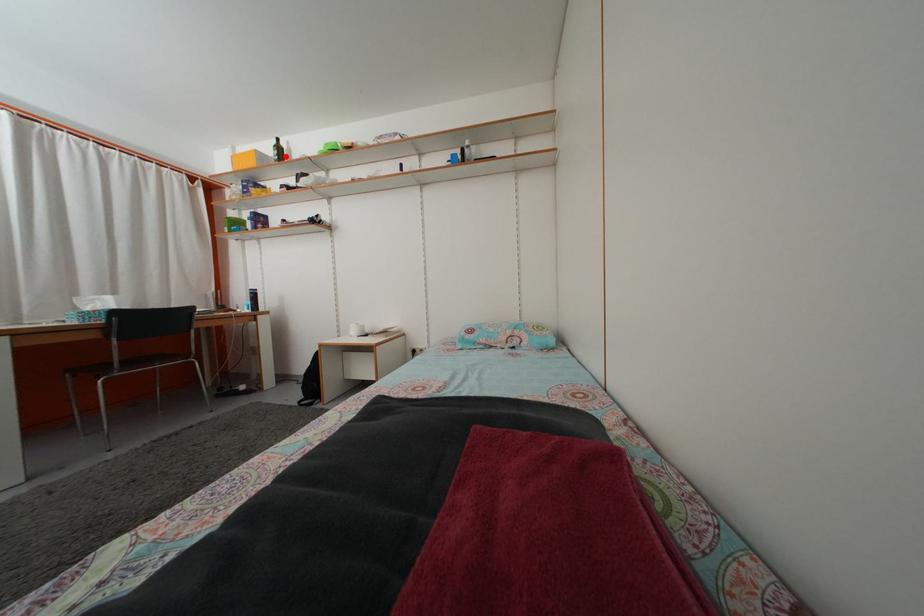
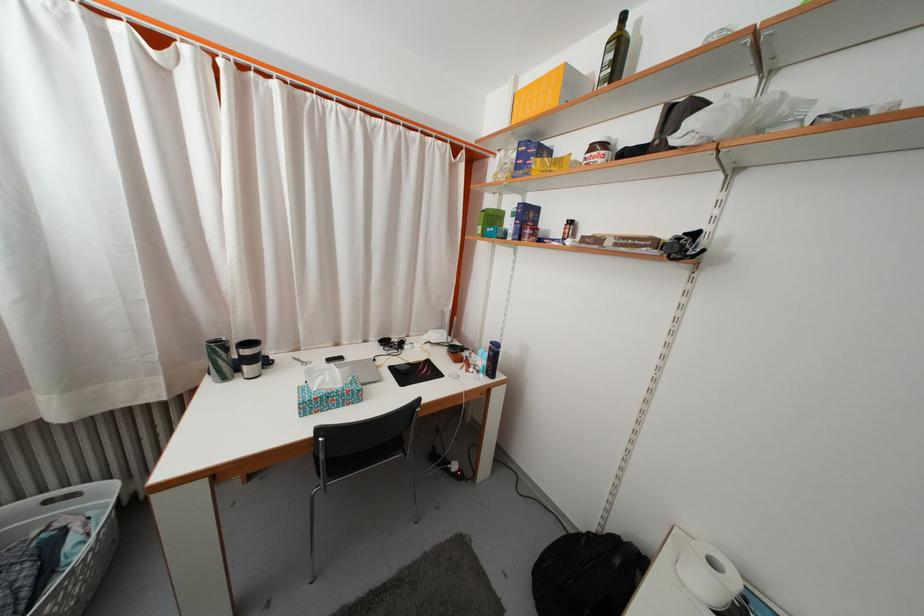
Locate, in the second image, the point that corresponds to the highlighted location in the first image.

(625, 54)